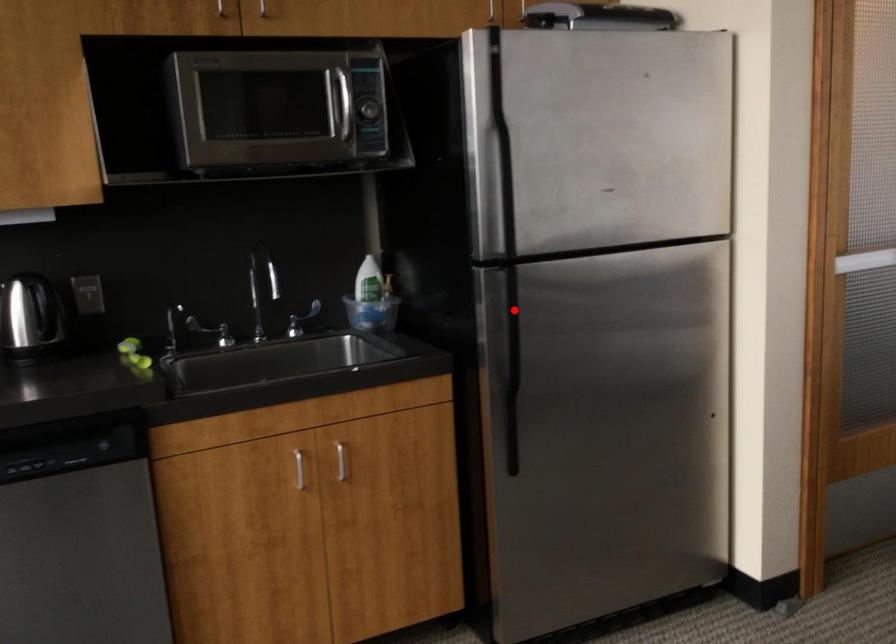
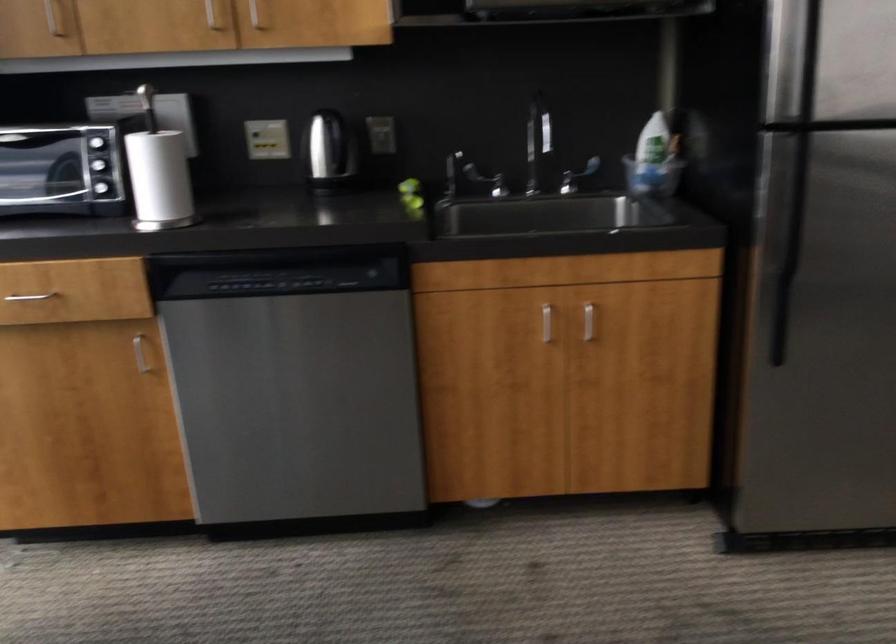
Question: I am providing you with two images of the same scene from different viewpoints. In image1, a red point is highlighted. Considering the same 3D point in image2, which of the following is correct?

Choices:
 (A) It is closer
 (B) It is farther

Answer: (A)